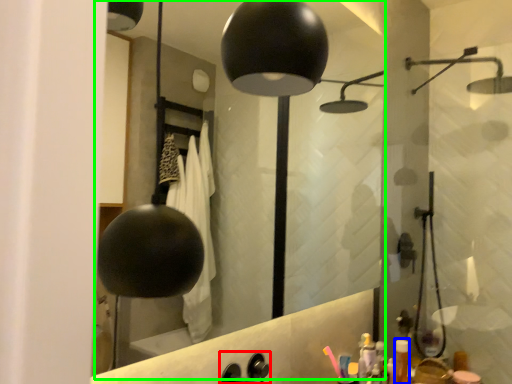
Question: Based on their relative distances, which object is nearer to faucet (highlighted by a red box)? Choose from toiletry (highlighted by a blue box) and mirror (highlighted by a green box).

Choices:
 (A) toiletry
 (B) mirror

Answer: (A)